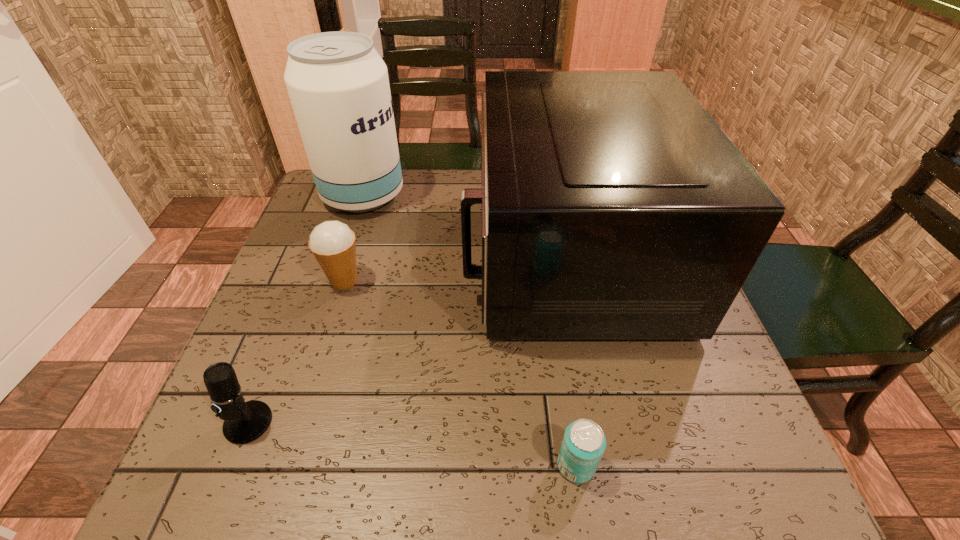
The image size is (960, 540). What are the coordinates of `alcohol` in the screenshot? It's located at (338, 84).

This screenshot has width=960, height=540. I want to click on the second tallest object, so click(613, 206).

Locate an element on the screen. The width and height of the screenshot is (960, 540). icecream is located at coordinates (332, 243).

Where is `the fourth farthest object`? This screenshot has width=960, height=540. the fourth farthest object is located at coordinates (244, 422).

Locate an element on the screen. the nearest object is located at coordinates (583, 444).

Where is `the shortest object`? the shortest object is located at coordinates (583, 444).

This screenshot has width=960, height=540. Identify the location of free location located on the front of the tallest object. (344, 255).

Find the location of a particular element. free point located 0.090m on the front-facing side of the microwave_oven is located at coordinates (x=427, y=255).

You are a GUI agent. You are given a task and a screenshot of the screen. Output one action in this format:
    pyautogui.click(x=<x>, y=<y>)
    Task: Click on the free location located 0.290m on the front-facing side of the microwave_oven
    The width and height of the screenshot is (960, 540).
    Given the screenshot: What is the action you would take?
    pyautogui.click(x=342, y=255)

Find the location of a particular element. The width and height of the screenshot is (960, 540). free space located on the front-facing side of the microwave_oven is located at coordinates (380, 255).